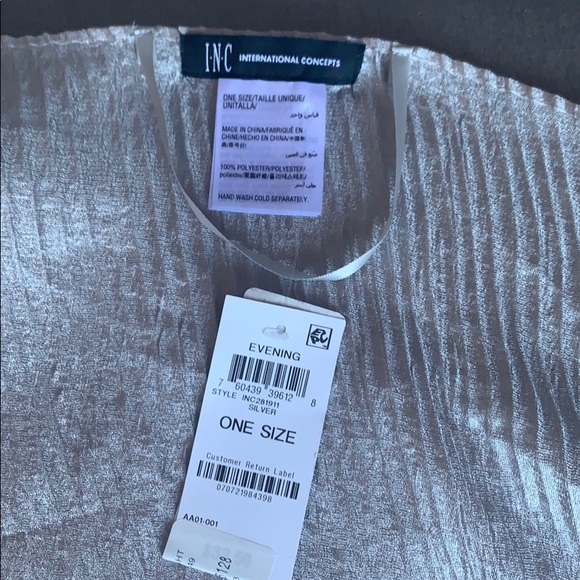
Locate an element on the screen. fabric is located at coordinates (441, 296).